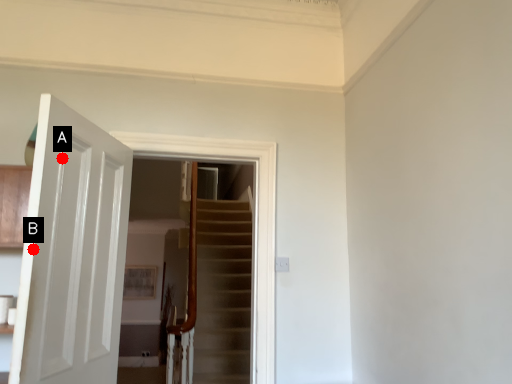
Question: Two points are circled on the image, labeled by A and B beside each circle. Which point is closer to the camera taking this photo?

Choices:
 (A) A is closer
 (B) B is closer

Answer: (B)